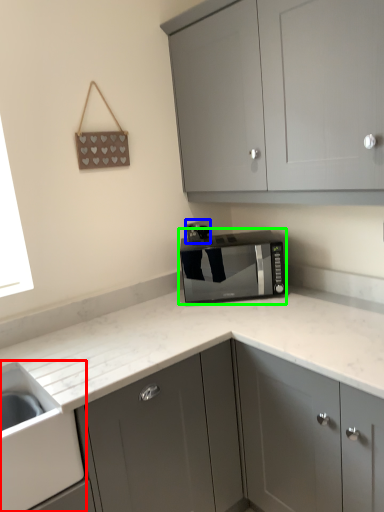
Question: Estimate the real-world distances between objects in this image. Which object is farther from sink (highlighted by a red box), electric outlet (highlighted by a blue box) or home appliance (highlighted by a green box)?

Choices:
 (A) electric outlet
 (B) home appliance

Answer: (A)